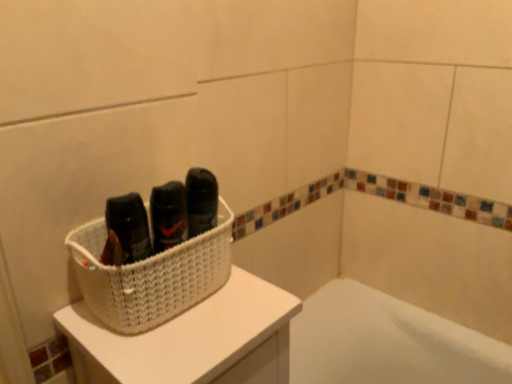
You are a GUI agent. You are given a task and a screenshot of the screen. Output one action in this format:
    pyautogui.click(x=<x>, y=<y>)
    Task: Click on the free location above white woven basket at upper left (from a real-world perspective)
    The image size is (512, 384).
    Given the screenshot: What is the action you would take?
    197,320